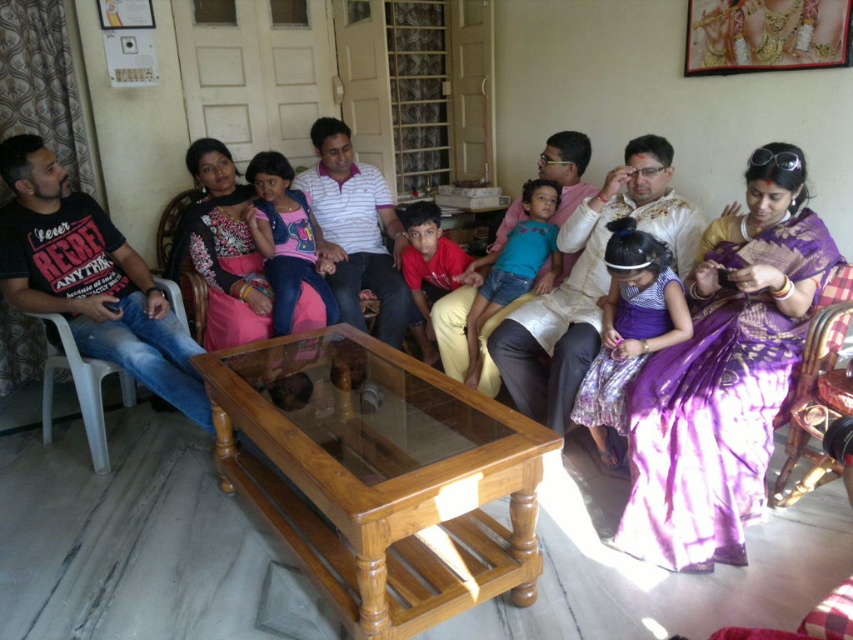
You are a fashion designer observing the group in the living room. You need to determine which saree would require more fabric to create between the purple silk saree at center and the matte pink saree at center. Which one would it be?

The purple silk saree at center is larger in size than the matte pink saree at center, so it would require more fabric to create.

You are standing in the living room and want to find the purple silk saree at center. According to the coordinates given, where should you look relative to the room?

The purple silk saree at center is located at the coordinates point 0.586 on the x axis and 0.852 on the y axis relative to the room.

You are standing in the living room and want to reach both points marked in the scene. Which point, point (x=735, y=289) or point (x=212, y=144), would you reach first if you walk straight towards them?

You would reach point (x=735, y=289) first because it is closer to you than point (x=212, y=144).